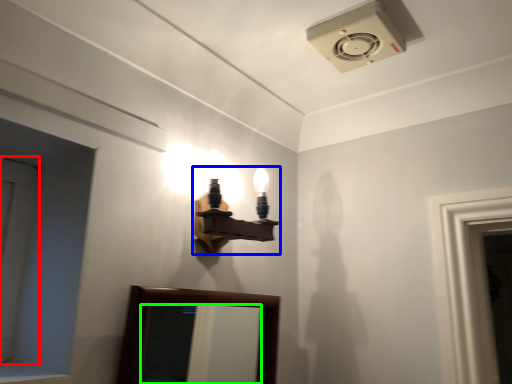
Question: Estimate the real-world distances between objects in this image. Which object is farther from door (highlighted by a red box), lamp (highlighted by a blue box) or mirror (highlighted by a green box)?

Choices:
 (A) lamp
 (B) mirror

Answer: (B)